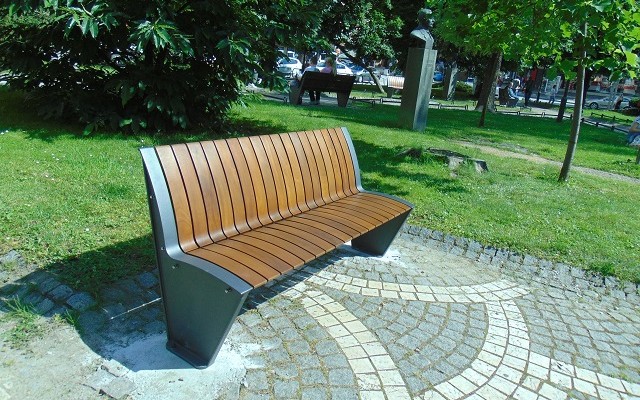
This screenshot has width=640, height=400. In order to click on wooden structure in this screenshot , I will do `click(596, 119)`.